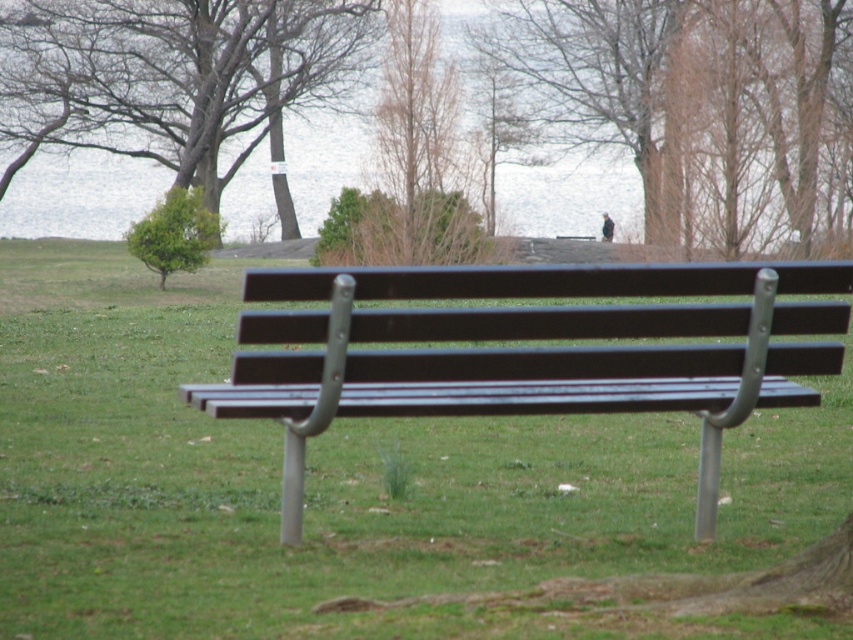
Between matte black bench at center and green leafy tree at upper left, which one appears on the left side from the viewer's perspective?

green leafy tree at upper left is more to the left.

Who is more distant from viewer, (486, 362) or (164, 227)?

Point (164, 227)

Locate an element on the screen. The height and width of the screenshot is (640, 853). matte black bench at center is located at coordinates (527, 352).

You are a GUI agent. You are given a task and a screenshot of the screen. Output one action in this format:
    pyautogui.click(x=<x>, y=<y>)
    Task: Click on the matte black bench at center
    The image size is (853, 640).
    Given the screenshot: What is the action you would take?
    pyautogui.click(x=527, y=352)

Does matte black bench at center appear on the right side of brown/dried wood tree at upper center?

Indeed, matte black bench at center is positioned on the right side of brown/dried wood tree at upper center.

Find the location of a particular element. The image size is (853, 640). matte black bench at center is located at coordinates (527, 352).

I want to click on matte black bench at center, so click(x=527, y=352).

Is brown wood tree at upper center below green leafy tree at upper left?

Incorrect, brown wood tree at upper center is not positioned below green leafy tree at upper left.

Which is behind, point (581, 13) or point (181, 225)?

The point (581, 13) is more distant.

Is point (519, 88) positioned in front of point (192, 189)?

No.

You are a GUI agent. You are given a task and a screenshot of the screen. Output one action in this format:
    pyautogui.click(x=<x>, y=<y>)
    Task: Click on the brown wood tree at upper center
    This screenshot has height=640, width=853.
    Given the screenshot: What is the action you would take?
    pyautogui.click(x=686, y=100)